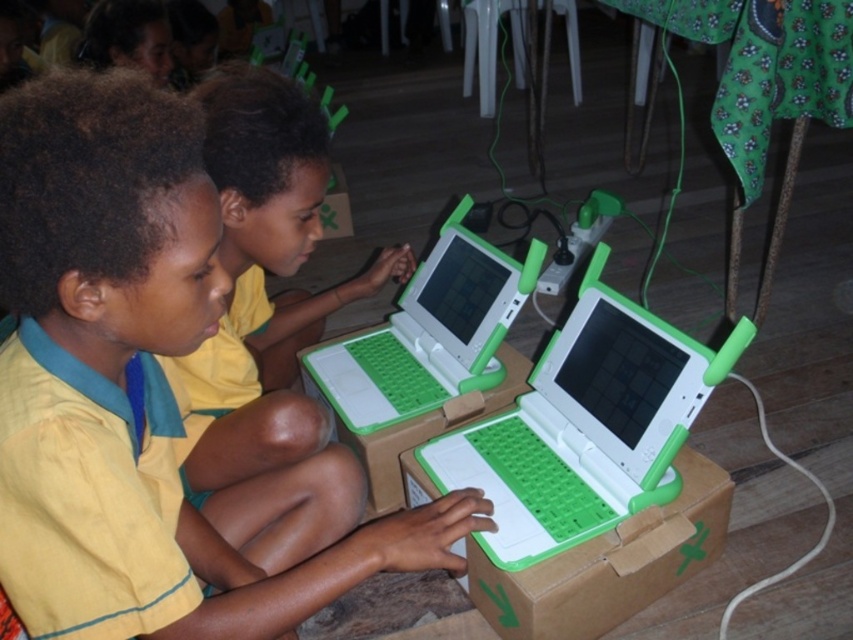
You are a teacher in the classroom. You need to place a new laptop on a box so it can be seen by all students. The white plastic laptop at center is currently below the green cardboard box at center. Is the laptop visible to the students from the front of the classroom?

The white plastic laptop at center is below the green cardboard box at center, so it is likely blocked by the box and not visible to the students from the front of the classroom.

You are a photographer trying to capture a closeup of the white plastic laptop at center and the green cardboard box at center. Which object should you focus on first to ensure the laptop is in sharp focus?

You should focus on the white plastic laptop at center first because it is closer to the viewer than the green cardboard box at center, so adjusting focus starting from the closer object ensures sharpness.

What is located at the coordinates point [108,227] in the image?

The yellow fabric shirt at center is located at point [108,227].